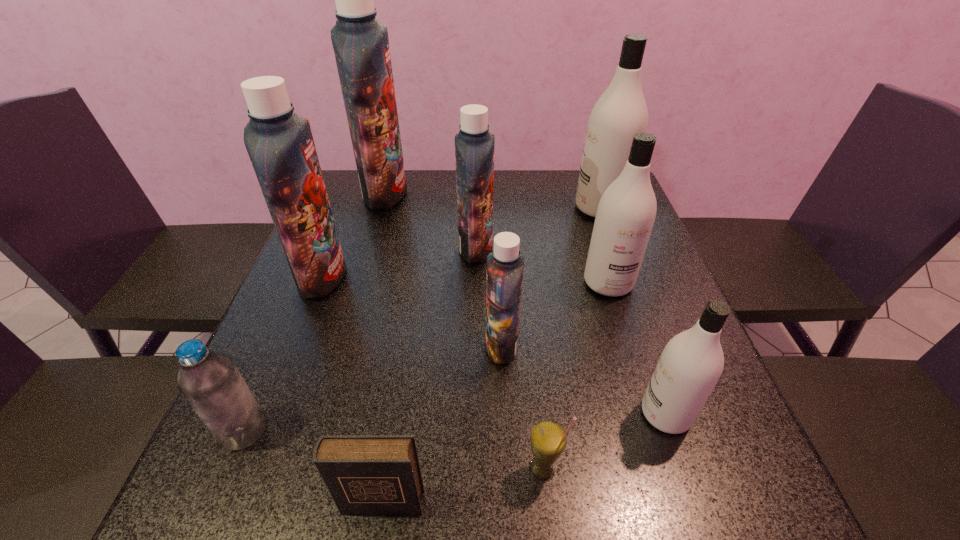
The width and height of the screenshot is (960, 540). I want to click on water bottle, so click(209, 380).

Find the location of a particular element. The width and height of the screenshot is (960, 540). blue water bottle is located at coordinates (209, 380).

Find the location of a particular element. straw for drinking is located at coordinates (548, 438).

Identify the location of the seventh object from right to left. This screenshot has height=540, width=960. (365, 474).

Identify the location of dark diary. The width and height of the screenshot is (960, 540). (365, 474).

Where is `free location located 0.270m on the front label of the tallest object`? free location located 0.270m on the front label of the tallest object is located at coordinates (496, 193).

Where is `free space located 0.110m on the front-facing side of the biggest white shampoo`? free space located 0.110m on the front-facing side of the biggest white shampoo is located at coordinates (537, 208).

Find the location of a particular element. This screenshot has width=960, height=540. blank space located 0.400m on the front-facing side of the biggest white shampoo is located at coordinates (436, 208).

Identify the location of vacant area located on the front-facing side of the biggest white shampoo. (529, 208).

At what (x,y) coordinates should I click in order to perform the action: click on free spot located on the front label of the third smallest blue shampoo. Please return your answer as a coordinate pair (x, y). The image size is (960, 540). Looking at the image, I should click on (366, 276).